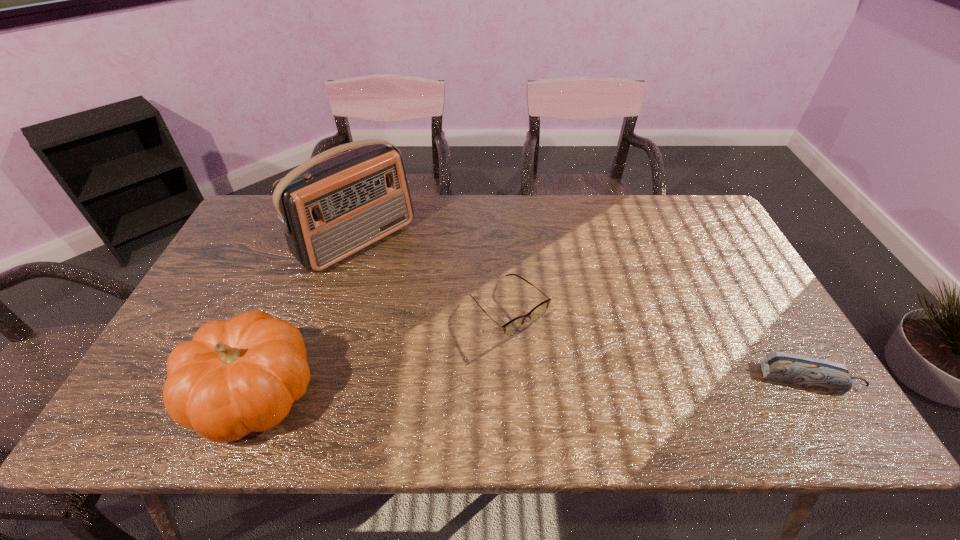
Identify the location of pumpkin. (237, 376).

The image size is (960, 540). What are the coordinates of `the rightmost object` in the screenshot? It's located at (804, 371).

The height and width of the screenshot is (540, 960). Find the location of `the tallest object`. the tallest object is located at coordinates (329, 209).

This screenshot has width=960, height=540. Find the location of `the second object from right to left`. the second object from right to left is located at coordinates [511, 327].

The image size is (960, 540). Identify the location of free spot located on the right of the second tallest object. (392, 393).

The image size is (960, 540). I want to click on free location located 0.320m on the back of the rightmost object, so click(742, 271).

Find the location of a particular element. This screenshot has height=540, width=960. vacant position located 0.200m on the front-facing side of the tallest object is located at coordinates (433, 305).

What are the coordinates of `vacant space located 0.110m on the front-facing side of the tallest object` in the screenshot? It's located at (413, 287).

At what (x,y) coordinates should I click in order to perform the action: click on free space located on the front-facing side of the tallest object. Please return your answer as a coordinate pair (x, y). This screenshot has width=960, height=540. Looking at the image, I should click on (430, 303).

What are the coordinates of `vacant region located on the face of the third object from left to right` in the screenshot? It's located at (592, 390).